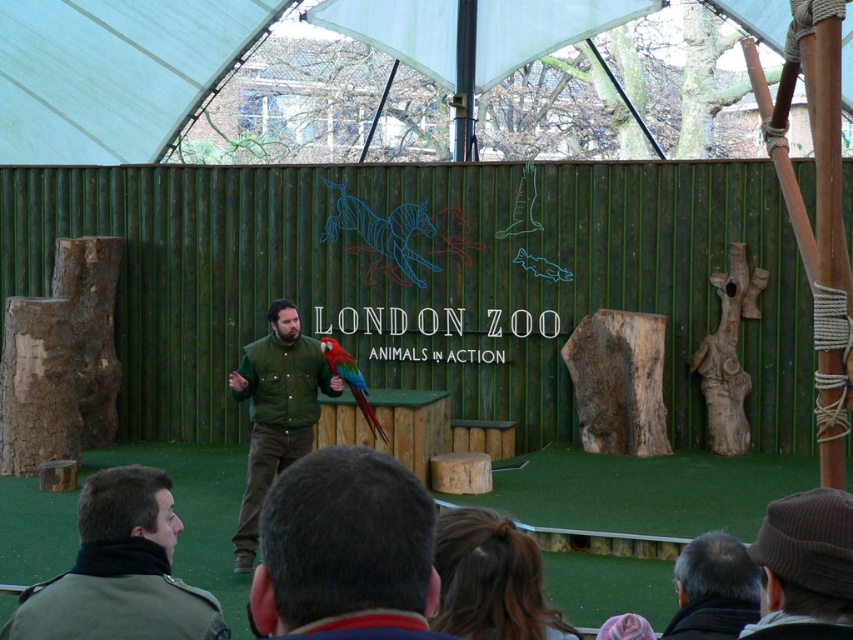
Which is more to the right, brown knitted hat at upper right or gray hair at lower right?

gray hair at lower right is more to the right.

Who is more distant from viewer, (740, 632) or (715, 602)?

The point (715, 602) is behind.

Between point (817, 584) and point (718, 627), which one is positioned behind?

Positioned behind is point (718, 627).

Identify the location of brown knitted hat at upper right. This screenshot has height=640, width=853. (805, 566).

Is green matte jacket at lower left shorter than green matte vest at center?

Indeed, green matte jacket at lower left has a lesser height compared to green matte vest at center.

Between point (212, 612) and point (236, 392), which one is positioned in front?

Point (212, 612) is more forward.

I want to click on green matte jacket at lower left, so click(120, 570).

Who is more forward, (287, 556) or (682, 570)?

Point (287, 556) is more forward.

Does dark brown hair at lower center have a lesser width compared to gray hair at lower right?

No, dark brown hair at lower center is not thinner than gray hair at lower right.

Does point (293, 552) come farther from viewer compared to point (703, 576)?

No, it is not.

I want to click on dark brown hair at lower center, so (345, 550).